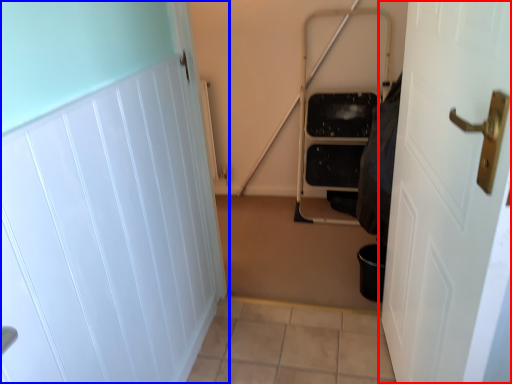
Question: Which of the following is the farthest to the observer, door (highlighted by a red box) or door (highlighted by a blue box)?

Choices:
 (A) door
 (B) door

Answer: (B)